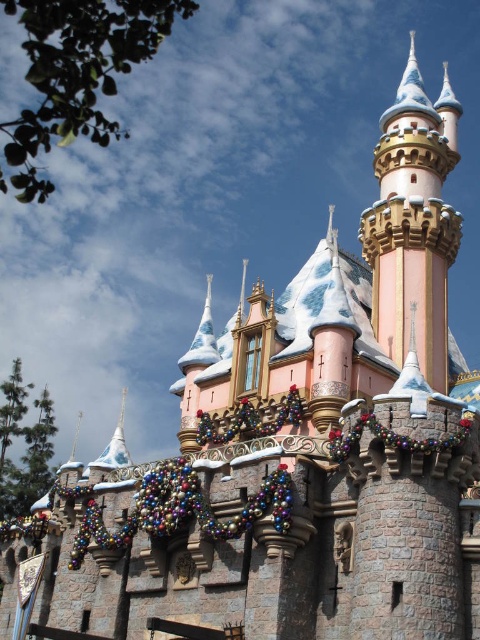
You are a maintenance worker tasked with checking the distance between the pink stone castle tower at upper right and the multicolored glass garland at lower center. According to the castle blueprints, the safety distance should be at least 30 meters. Is the current distance compliant with the safety standards?

The distance between the pink stone castle tower at upper right and the multicolored glass garland at lower center is 29.12 meters, which is below the required 30 meters safety standard. Therefore, it does not comply with the safety requirements.

From the picture: You are a visitor standing at the base of the pink stone castle tower at upper right and the multicolored glass garland at lower center. Which object is higher from the ground?

The pink stone castle tower at upper right is taller than the multicolored glass garland at lower center, so the tower is higher from the ground.

Consider the image. You are a castle decorator who wants to hang a new decoration between the multicolored glass garland at lower center and the metallic garland at center. Which garland should you place higher to maintain symmetry?

The multicolored glass garland at lower center has a greater height compared to the metallic garland at center, so to maintain symmetry, you should place the new decoration higher near the multicolored glass garland at lower center.